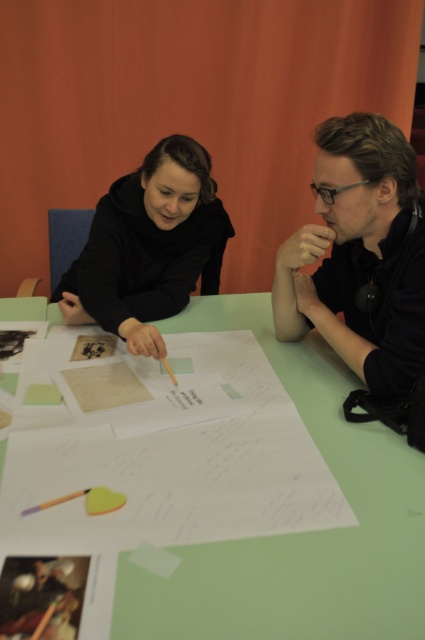
You are standing in front of the table where two people are collaborating. There are two points marked on the table surface. The first point is at coordinates point (365, 608) and the second is at point (85, 300). Which point is closer to you?

Point (365, 608) is closer to the viewer than point (85, 300).

You are a designer who needs to place a new object on the table. The table has a black matte paper at center and a black matte shirt at center. Which object should you place the new object on top of to ensure it doesn

The black matte paper at center is bigger than the black matte shirt at center, so placing the new object on top of the black matte paper at center would provide a larger surface area for stability.